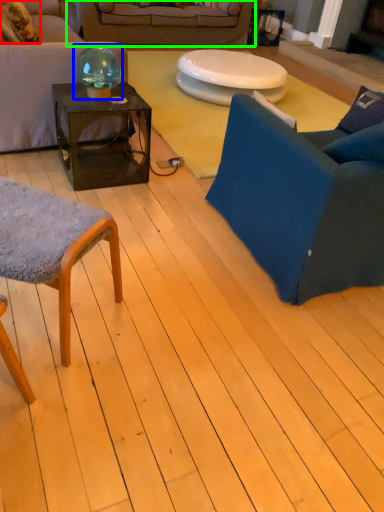
Question: Which is nearer to the pillow (highlighted by a red box)? teal (highlighted by a blue box) or studio couch (highlighted by a green box).

Choices:
 (A) teal
 (B) studio couch

Answer: (A)